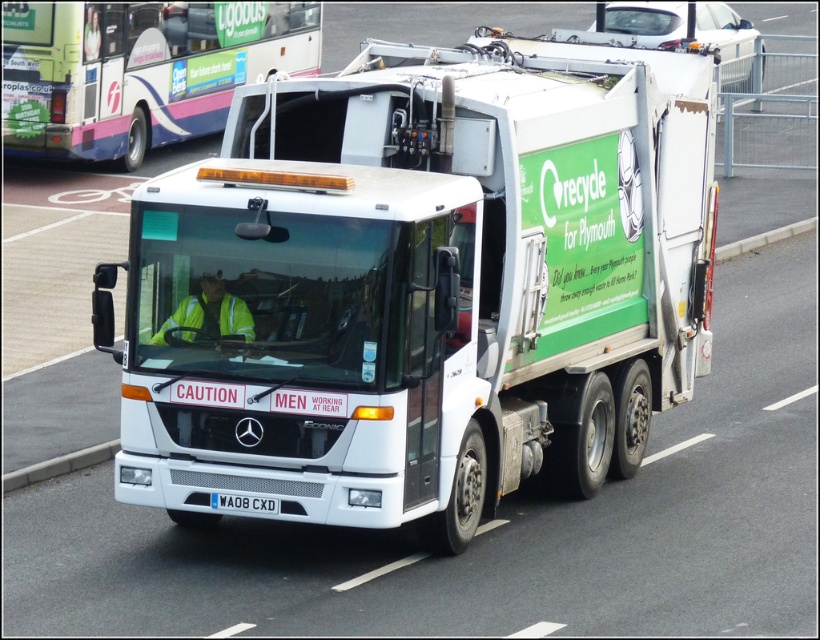
Is point (89, 52) in front of point (226, 496)?

No, (89, 52) is behind (226, 496).

Can you confirm if white glossy bus at center is positioned below white plastic license plate at center?

Incorrect, white glossy bus at center is not positioned below white plastic license plate at center.

Which is behind, point (57, 17) or point (253, 500)?

Point (57, 17)

The height and width of the screenshot is (640, 820). I want to click on white glossy bus at center, so click(x=139, y=70).

Does white glossy truck at center appear on the right side of white glossy bus at center?

Correct, you'll find white glossy truck at center to the right of white glossy bus at center.

Looking at this image, does white glossy truck at center have a lesser height compared to white glossy bus at center?

No.

Where is `white glossy truck at center`? This screenshot has width=820, height=640. white glossy truck at center is located at coordinates (422, 284).

In order to click on white glossy truck at center in this screenshot , I will do `click(422, 284)`.

Between point (613, 410) and point (215, 500), which one is positioned in front?

Point (215, 500) is more forward.

Is point (344, 420) less distant than point (210, 493)?

That is True.

Which is in front, point (270, 310) or point (229, 506)?

Point (270, 310) is in front.

At what (x,y) coordinates should I click in order to perform the action: click on white glossy truck at center. Please return your answer as a coordinate pair (x, y). The image size is (820, 640). Looking at the image, I should click on (422, 284).